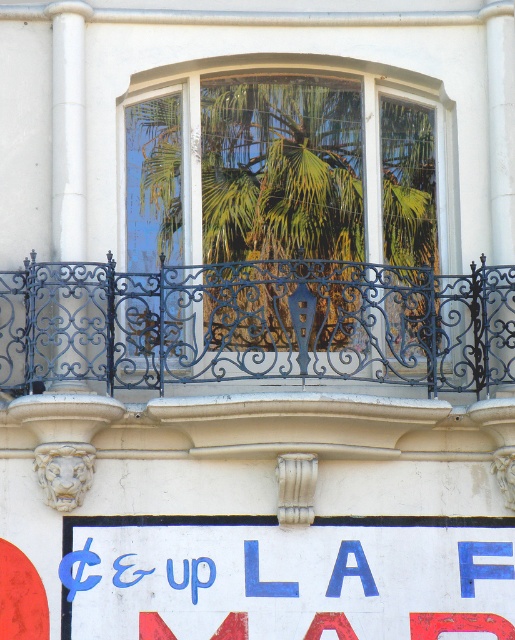
Is clear glass window at center wider than white painted signboard at lower center?

Incorrect, clear glass window at center's width does not surpass white painted signboard at lower center's.

Which is more to the left, clear glass window at center or white painted signboard at lower center?

clear glass window at center

Does point (412, 234) lie in front of point (214, 541)?

No, it is behind (214, 541).

Where is `clear glass window at center`? The width and height of the screenshot is (515, 640). clear glass window at center is located at coordinates (283, 227).

Looking at this image, does clear glass window at center have a greater height compared to black wrought iron balcony at center?

Indeed, clear glass window at center has a greater height compared to black wrought iron balcony at center.

The image size is (515, 640). Identify the location of clear glass window at center. (x=283, y=227).

Who is more forward, [381,326] or [290,572]?

Point [290,572] is in front.

Locate an element on the screen. black wrought iron balcony at center is located at coordinates pyautogui.click(x=255, y=324).